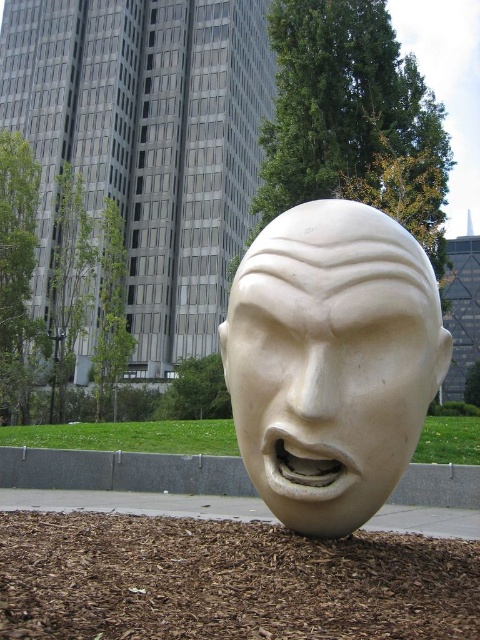
Question: Which of the following is the closest to the observer?

Choices:
 (A) (29, 552)
 (B) (359, 500)

Answer: (A)

Question: Does white marble head at center come in front of brown mulch at lower center?

Choices:
 (A) no
 (B) yes

Answer: (A)

Question: Which point appears farthest from the camera in this image?

Choices:
 (A) (382, 493)
 (B) (204, 554)

Answer: (A)

Question: Can you confirm if white marble head at center is positioned to the left of brown mulch at lower center?

Choices:
 (A) no
 (B) yes

Answer: (A)

Question: Which object appears farthest from the camera in this image?

Choices:
 (A) brown mulch at lower center
 (B) white marble head at center

Answer: (B)

Question: Does white marble head at center have a greater width compared to brown mulch at lower center?

Choices:
 (A) no
 (B) yes

Answer: (A)